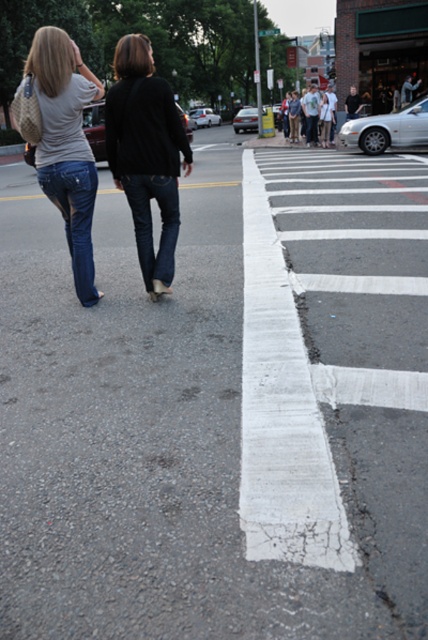
Is point (133, 164) farther from viewer compared to point (142, 204)?

No, (133, 164) is closer to viewer.

From the picture: Measure the distance between point (154,282) and camera.

Point (154,282) is 4.15 meters from camera.

Does point (133, 102) come farther from viewer compared to point (163, 195)?

No, it is in front of (163, 195).

Image resolution: width=428 pixels, height=640 pixels. I want to click on black matte sweater at center, so click(x=145, y=154).

Which is below, denim jeans at left or denim at center?

Positioned lower is denim at center.

Between denim jeans at left and denim at center, which one appears on the left side from the viewer's perspective?

denim jeans at left is more to the left.

Find the location of `denim jeans at left`. denim jeans at left is located at coordinates (67, 145).

Who is positioned more to the right, denim jeans at lower left or denim at center?

Positioned to the right is denim at center.

What do you see at coordinates (74, 216) in the screenshot?
I see `denim jeans at lower left` at bounding box center [74, 216].

The height and width of the screenshot is (640, 428). I want to click on denim jeans at lower left, so click(x=74, y=216).

You are a GUI agent. You are given a task and a screenshot of the screen. Output one action in this format:
    pyautogui.click(x=<x>, y=<y>)
    Task: Click on the denim jeans at lower left
    This screenshot has height=640, width=428.
    Given the screenshot: What is the action you would take?
    pyautogui.click(x=74, y=216)